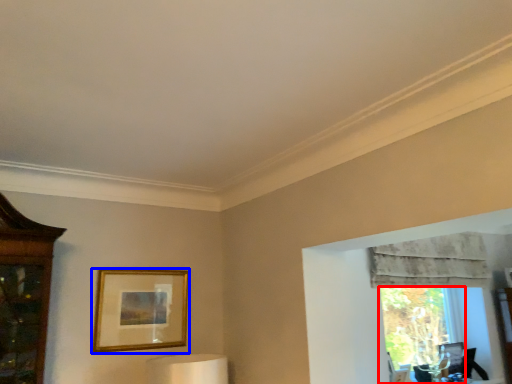
Question: Which point is further to the camera, window (highlighted by a red box) or picture frame (highlighted by a blue box)?

Choices:
 (A) window
 (B) picture frame

Answer: (A)